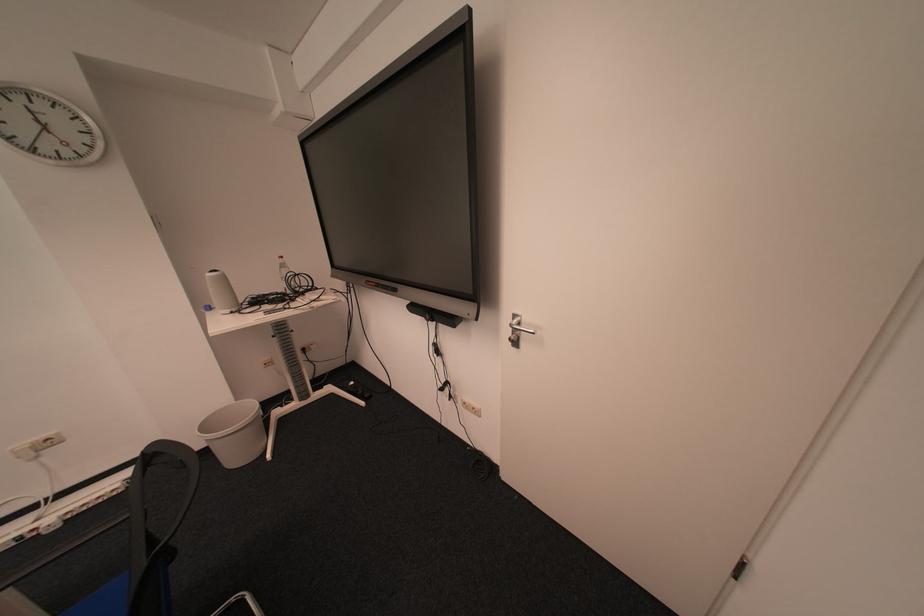
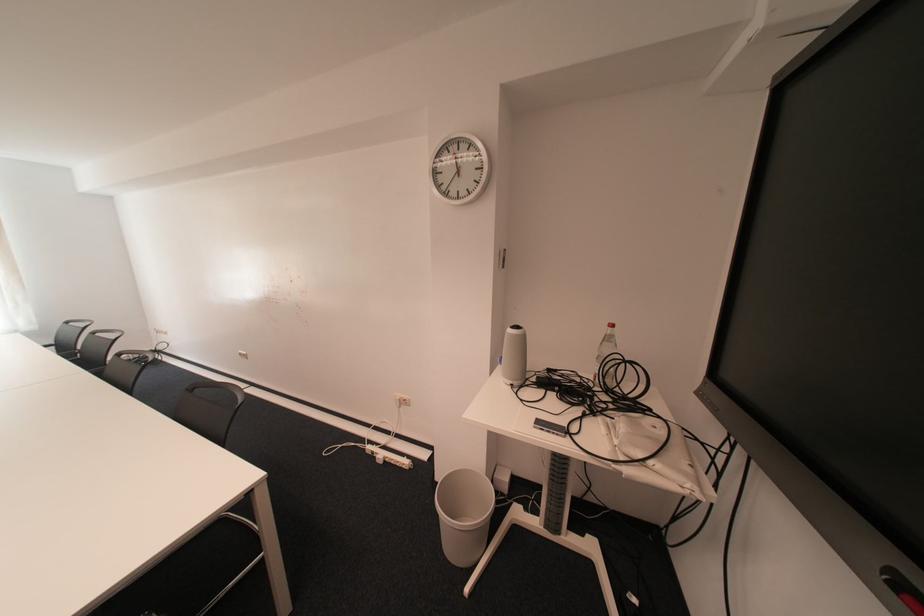
Locate, in the second image, the point that corresponds to (292,268) in the first image.

(614, 341)